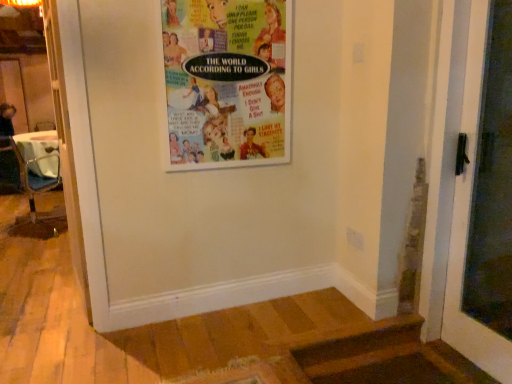
Question: From a real-world perspective, is white glossy door at right below multicolored paper poster at upper center?

Choices:
 (A) yes
 (B) no

Answer: (A)

Question: Is white glossy door at right wider than multicolored paper poster at upper center?

Choices:
 (A) yes
 (B) no

Answer: (A)

Question: Does white glossy door at right have a greater height compared to multicolored paper poster at upper center?

Choices:
 (A) yes
 (B) no

Answer: (A)

Question: Is white glossy door at right surrounding multicolored paper poster at upper center?

Choices:
 (A) yes
 (B) no

Answer: (B)

Question: Is the depth of white glossy door at right less than that of multicolored paper poster at upper center?

Choices:
 (A) no
 (B) yes

Answer: (B)

Question: From the image's perspective, is white glossy door at right above multicolored paper poster at upper center?

Choices:
 (A) yes
 (B) no

Answer: (B)

Question: Is metallic silver chair at left to the left of white glossy door at right from the viewer's perspective?

Choices:
 (A) no
 (B) yes

Answer: (B)

Question: Can you confirm if metallic silver chair at left is taller than white glossy door at right?

Choices:
 (A) yes
 (B) no

Answer: (B)

Question: Is metallic silver chair at left oriented away from white glossy door at right?

Choices:
 (A) no
 (B) yes

Answer: (A)

Question: Is metallic silver chair at left at the right side of white glossy door at right?

Choices:
 (A) yes
 (B) no

Answer: (B)

Question: From a real-world perspective, is metallic silver chair at left physically below white glossy door at right?

Choices:
 (A) yes
 (B) no

Answer: (A)

Question: Is metallic silver chair at left next to white glossy door at right?

Choices:
 (A) no
 (B) yes

Answer: (A)

Question: Is the depth of metallic silver chair at left less than that of multicolored paper poster at upper center?

Choices:
 (A) no
 (B) yes

Answer: (A)